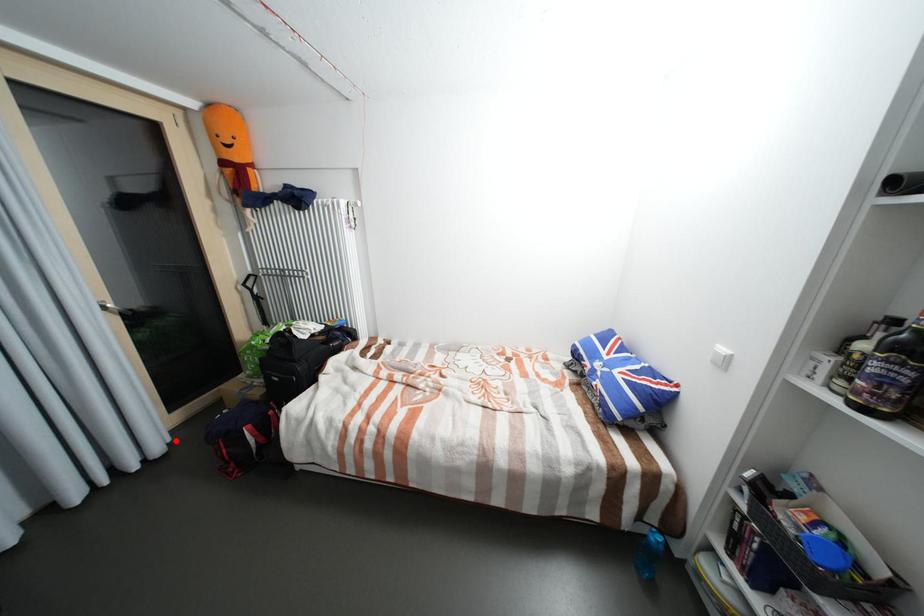
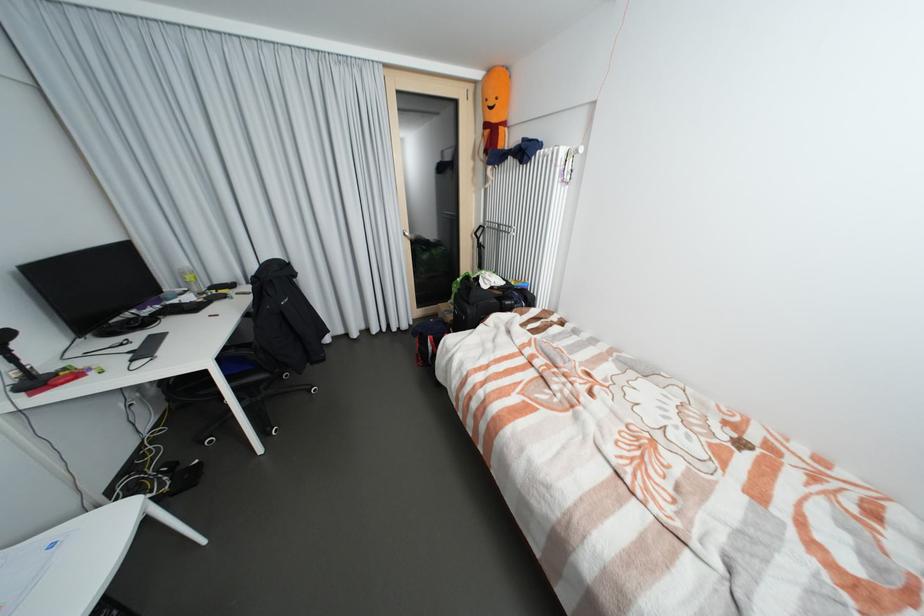
Find the pixel in the second image that matches the highlighted location in the first image.

(418, 323)